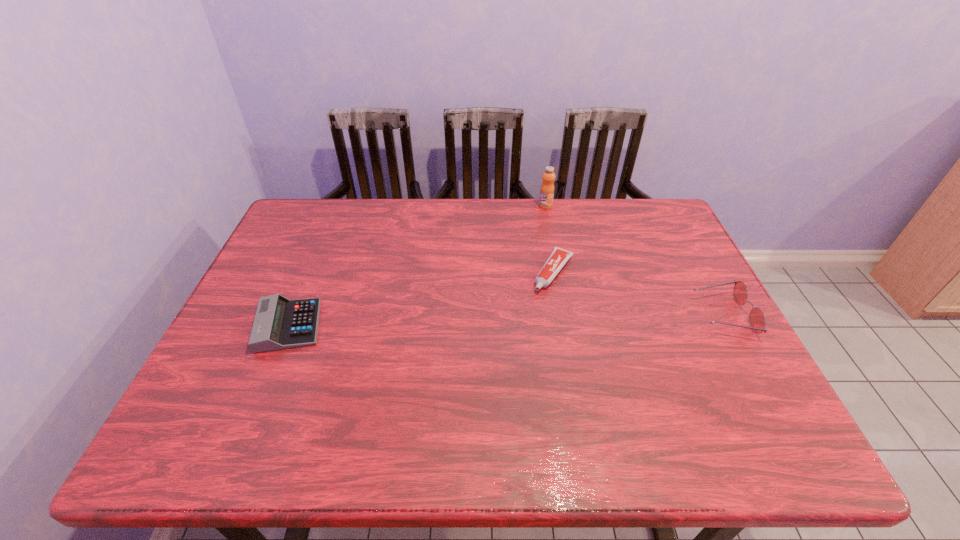
Image resolution: width=960 pixels, height=540 pixels. In order to click on vacant space at the near edge of the desktop in this screenshot , I will do `click(671, 404)`.

The image size is (960, 540). Identify the location of vacant position at the left edge of the desktop. (240, 328).

At what (x,y) coordinates should I click in order to perform the action: click on free region at the right edge of the desktop. Please return your answer as a coordinate pair (x, y). Looking at the image, I should click on (695, 348).

Find the location of a particular element. vacant space at the far left corner of the desktop is located at coordinates (294, 221).

This screenshot has height=540, width=960. What are the coordinates of `free space at the near left corner of the desktop` in the screenshot? It's located at (211, 383).

Locate an element on the screen. This screenshot has height=540, width=960. vacant space at the far right corner of the desktop is located at coordinates (621, 200).

You are a GUI agent. You are given a task and a screenshot of the screen. Output one action in this format:
    pyautogui.click(x=<x>, y=<y>)
    Task: Click on the vacant space that is in between the leftmost object and the rightmost object
    This screenshot has height=540, width=960.
    Given the screenshot: What is the action you would take?
    pyautogui.click(x=506, y=320)

Where is `empty space between the calculator and the farthest object`? The height and width of the screenshot is (540, 960). empty space between the calculator and the farthest object is located at coordinates (418, 266).

This screenshot has width=960, height=540. I want to click on vacant space that's between the rightmost object and the farthest object, so click(634, 260).

The height and width of the screenshot is (540, 960). In order to click on unoccupied area between the farthest object and the spectacles in this screenshot , I will do `click(634, 260)`.